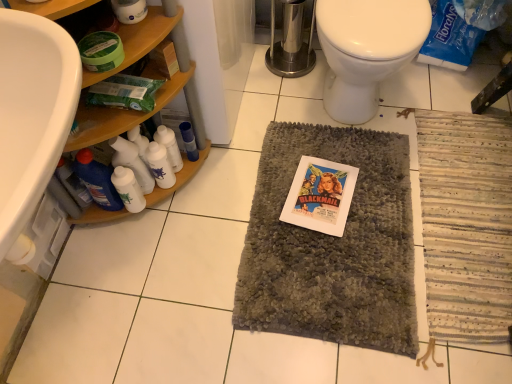
Where is `free space in front of blue glossy bottle at lower left, which is the 5th bottle from right to left`? This screenshot has width=512, height=384. free space in front of blue glossy bottle at lower left, which is the 5th bottle from right to left is located at coordinates (112, 251).